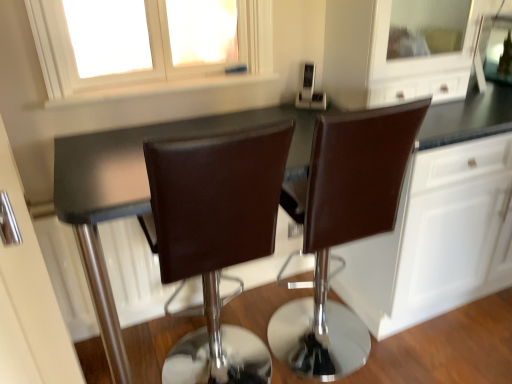
The image size is (512, 384). In order to click on vacant area situated to the left side of satin silver toaster at upper center in this screenshot , I will do `click(286, 110)`.